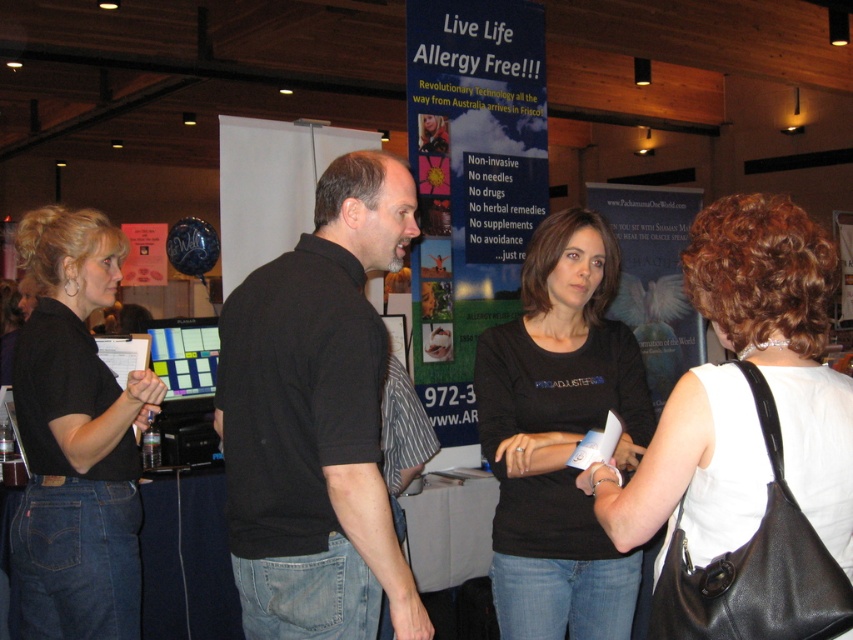
Question: Does white leather purse at right have a larger size compared to black matte shirt at left?

Choices:
 (A) no
 (B) yes

Answer: (A)

Question: Does black matte shirt at center appear on the left side of black matte shirt at left?

Choices:
 (A) no
 (B) yes

Answer: (A)

Question: Estimate the real-world distances between objects in this image. Which object is closer to the black matte shirt at center?

Choices:
 (A) black matte shirt at left
 (B) black cotton shirt at center

Answer: (B)

Question: Which object appears farthest from the camera in this image?

Choices:
 (A) black cotton shirt at center
 (B) black matte shirt at left
 (C) white leather purse at right

Answer: (B)

Question: Which of the following is the farthest from the observer?

Choices:
 (A) (126, 483)
 (B) (531, 282)

Answer: (B)

Question: Is white leather purse at right wider than black matte shirt at center?

Choices:
 (A) yes
 (B) no

Answer: (B)